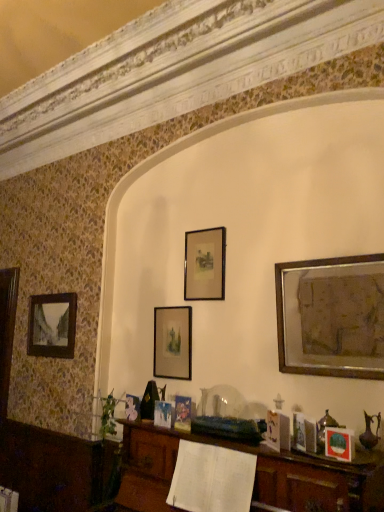
Locate an element on the screen. The width and height of the screenshot is (384, 512). free location to the left of matte black picture frame at lower right, marked as the fifth picture frame in a back-to-front arrangement is located at coordinates (322, 453).